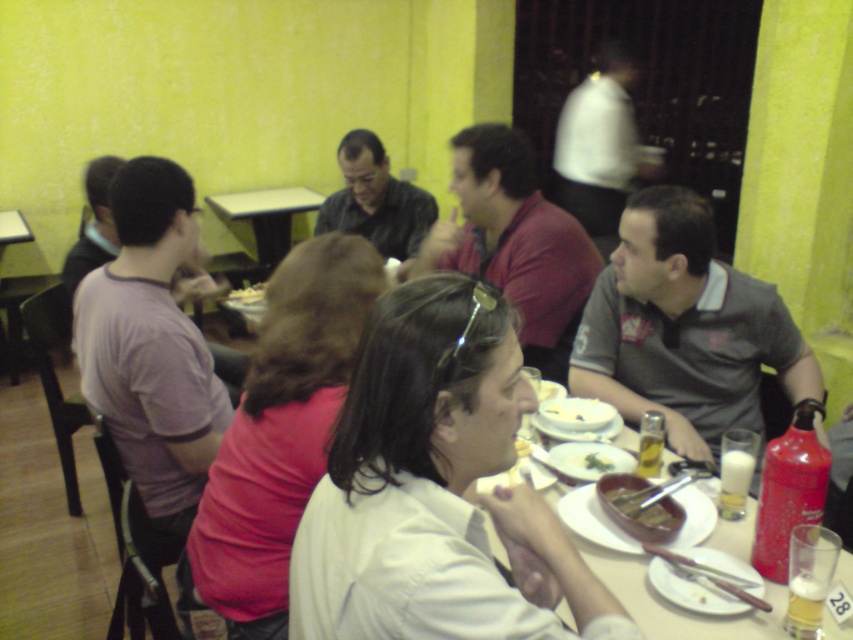
Question: Based on their relative distances, which object is farther from the purple cotton shirt at left?

Choices:
 (A) white matte shirt at upper center
 (B) matte black shirt at center
 (C) white matte plate at center
 (D) wooden table at center

Answer: (A)

Question: Is matte black shirt at center below white matte plate at center?

Choices:
 (A) no
 (B) yes

Answer: (A)

Question: Where is white matte shirt at center located in relation to brown matte bowl at center in the image?

Choices:
 (A) below
 (B) above

Answer: (B)

Question: Considering the real-world distances, which object is closest to the green leafy salad at center?

Choices:
 (A) white matte shirt at center
 (B) white matte shirt at upper center
 (C) matte red shirt at center

Answer: (A)

Question: Which object is farther from the camera taking this photo?

Choices:
 (A) green leafy salad at center
 (B) brown matte bowl at center
 (C) purple cotton shirt at left
 (D) white matte plate at center

Answer: (D)

Question: Does gray fabric shirt at right appear on the left side of green leafy salad at center?

Choices:
 (A) no
 (B) yes

Answer: (A)